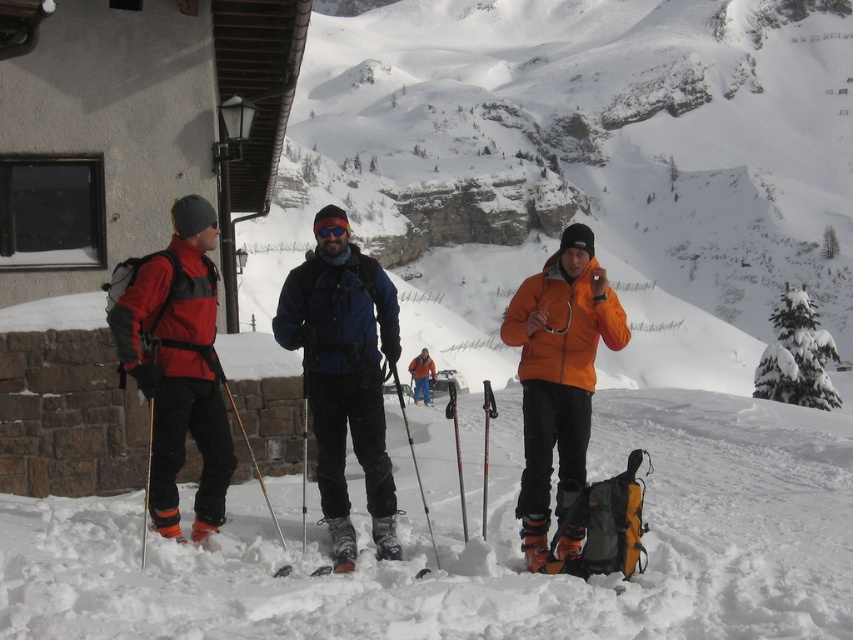
Question: Can you confirm if matte red jacket at left is bigger than black matte ski at lower center?

Choices:
 (A) yes
 (B) no

Answer: (A)

Question: Which point is farther to the camera?

Choices:
 (A) (277, 570)
 (B) (415, 384)

Answer: (B)

Question: Is matte red jacket at left closer to the viewer compared to orange matte jacket at center?

Choices:
 (A) no
 (B) yes

Answer: (B)

Question: Is matte red jacket at left bigger than black matte ski at lower center?

Choices:
 (A) no
 (B) yes

Answer: (B)

Question: Which point appears farthest from the camera in this image?

Choices:
 (A) (431, 372)
 (B) (312, 230)
 (C) (142, 282)
 (D) (335, 272)

Answer: (A)

Question: Which object is farther from the camera taking this photo?

Choices:
 (A) silver metallic ski pole at center
 (B) matte red jacket at left
 (C) blue matte jacket at center

Answer: (B)